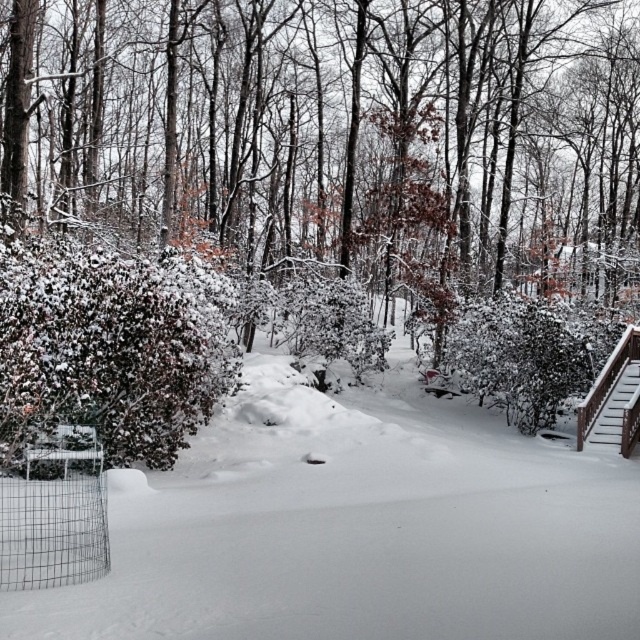
Measure the distance between snow-covered bush at left and camera.

They are 11.99 meters apart.

Does point (109, 275) come behind point (636, 387)?

No.

Is point (86, 349) positioned before point (612, 428)?

Yes.

This screenshot has width=640, height=640. I want to click on snow-covered bush at left, so click(x=109, y=348).